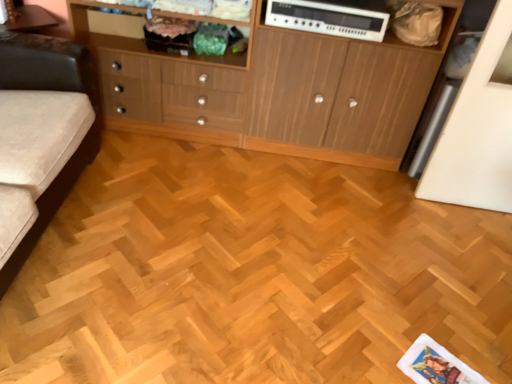
Question: Is the position of wooden cabinet at center less distant than that of white plastic stereo at upper center?

Choices:
 (A) no
 (B) yes

Answer: (B)

Question: Is wooden cabinet at center bigger than white plastic stereo at upper center?

Choices:
 (A) no
 (B) yes

Answer: (B)

Question: From a real-world perspective, is wooden cabinet at center under white plastic stereo at upper center?

Choices:
 (A) no
 (B) yes

Answer: (B)

Question: From the image's perspective, is wooden cabinet at center located above white plastic stereo at upper center?

Choices:
 (A) yes
 (B) no

Answer: (B)

Question: Can you confirm if wooden cabinet at center is positioned to the right of white plastic stereo at upper center?

Choices:
 (A) no
 (B) yes

Answer: (B)

Question: From the image's perspective, would you say wooden cabinet at center is shown under white plastic stereo at upper center?

Choices:
 (A) no
 (B) yes

Answer: (B)

Question: Can wooden cabinet at center be found inside white plastic stereo at upper center?

Choices:
 (A) yes
 (B) no

Answer: (B)

Question: Considering the relative sizes of white plastic stereo at upper center and wooden cabinet at center in the image provided, is white plastic stereo at upper center shorter than wooden cabinet at center?

Choices:
 (A) yes
 (B) no

Answer: (A)

Question: From a real-world perspective, is white plastic stereo at upper center positioned under wooden cabinet at center based on gravity?

Choices:
 (A) no
 (B) yes

Answer: (A)

Question: Does white plastic stereo at upper center have a smaller size compared to wooden cabinet at center?

Choices:
 (A) yes
 (B) no

Answer: (A)

Question: Is white plastic stereo at upper center placed right next to wooden cabinet at center?

Choices:
 (A) no
 (B) yes

Answer: (A)

Question: From the image's perspective, is white plastic stereo at upper center located above wooden cabinet at center?

Choices:
 (A) no
 (B) yes

Answer: (B)

Question: Could you tell me if wooden cabinet at left is facing white plastic stereo at upper center?

Choices:
 (A) no
 (B) yes

Answer: (A)